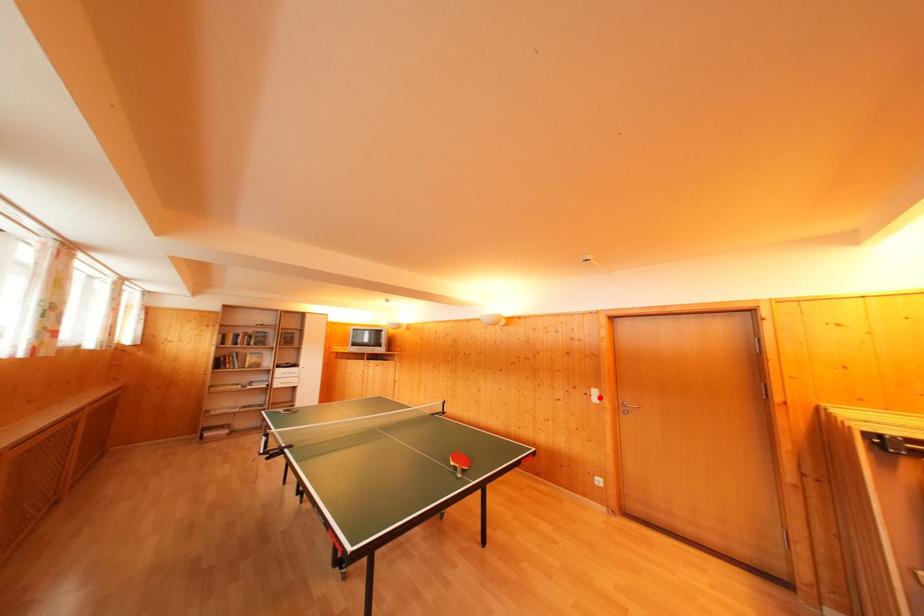
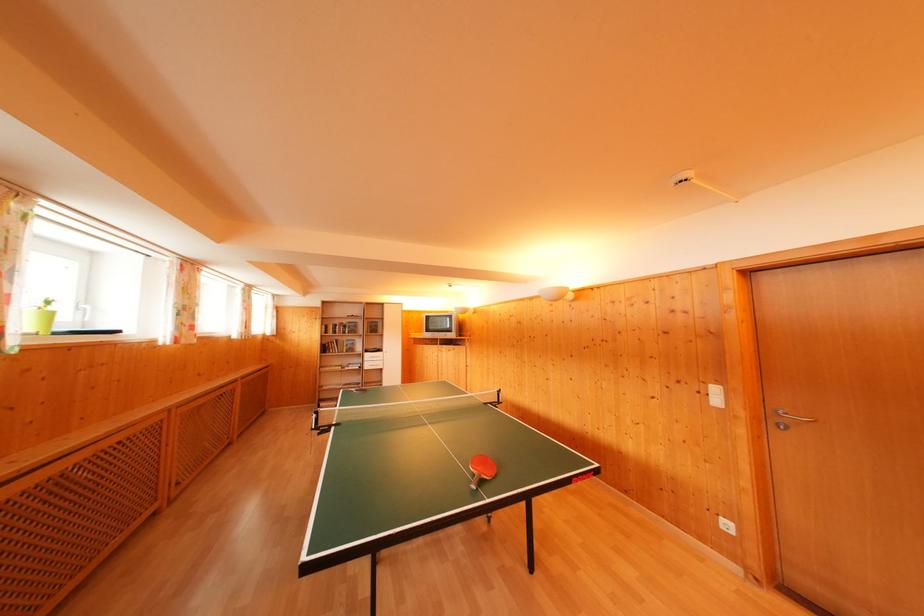
Find the pixel in the second image that matches the highlighted location in the first image.

(721, 395)